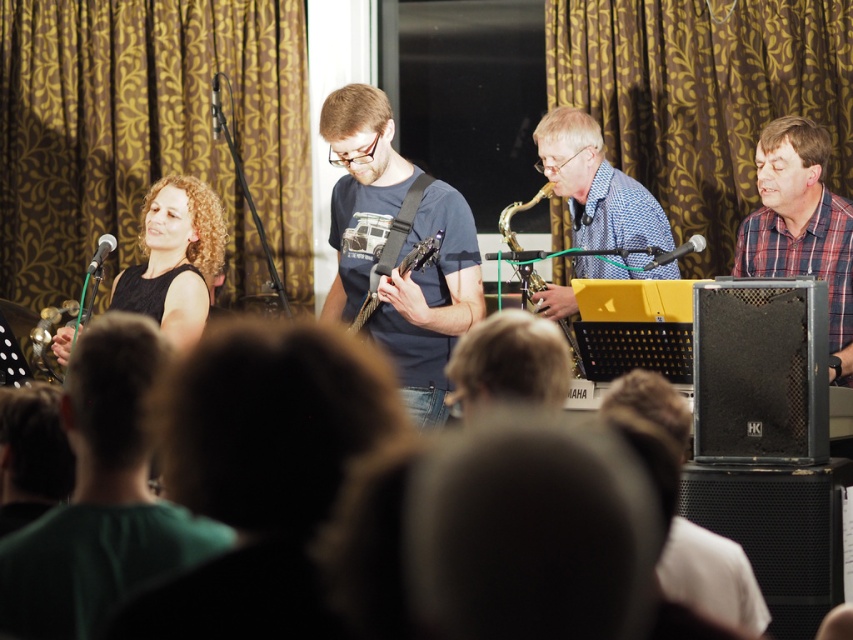
Question: Which point is farther to the camera?

Choices:
 (A) (583, 138)
 (B) (657, 260)
 (C) (212, 100)
 (D) (775, 145)

Answer: (C)

Question: Which object is farther from the camera taking this photo?

Choices:
 (A) plaid fabric shirt at right
 (B) matte black guitar at center
 (C) matte blue t-shirt at center
 (D) matte black microphone at left

Answer: (D)

Question: Does blue checkered shirt at center appear on the right side of black dress at left?

Choices:
 (A) no
 (B) yes

Answer: (B)

Question: Is green fabric shirt at left bigger than black dress at left?

Choices:
 (A) yes
 (B) no

Answer: (B)

Question: Among these objects, which one is nearest to the camera?

Choices:
 (A) dark green shirt at center
 (B) metallic silver microphone at upper center
 (C) blue checkered shirt at center

Answer: (A)

Question: Is blue checkered shirt at center below matte black microphone at left?

Choices:
 (A) yes
 (B) no

Answer: (B)